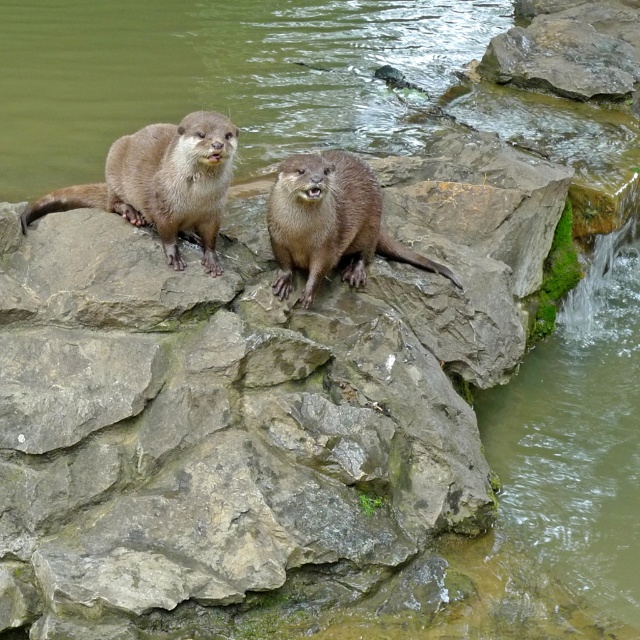
Question: Does brown furry otter at upper left come behind brown furry otter at center?

Choices:
 (A) no
 (B) yes

Answer: (A)

Question: Is brown furry otter at upper left further to the viewer compared to brown furry otter at center?

Choices:
 (A) yes
 (B) no

Answer: (B)

Question: Is brown furry otter at upper left positioned before brown furry otter at center?

Choices:
 (A) no
 (B) yes

Answer: (B)

Question: Which point is closer to the camera?

Choices:
 (A) brown furry otter at upper left
 (B) brown furry otter at center

Answer: (A)